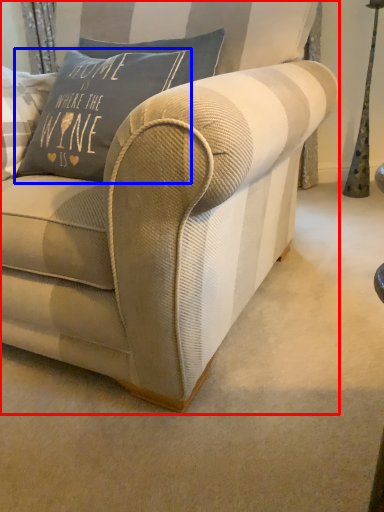
Question: Which object appears farthest to the camera in this image, studio couch (highlighted by a red box) or pillow (highlighted by a blue box)?

Choices:
 (A) studio couch
 (B) pillow

Answer: (B)